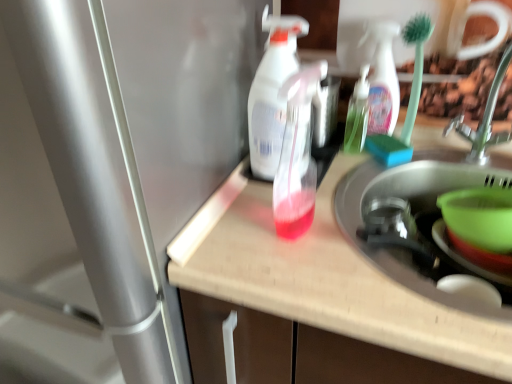
Question: From a real-world perspective, is metallic silver faucet at upper right below translucent plastic spray bottle at center, marked as the 1th bottle in a front-to-back arrangement?

Choices:
 (A) no
 (B) yes

Answer: (A)

Question: Is translucent plastic spray bottle at center, the 1th bottle in the left-to-right sequence, inside metallic silver faucet at upper right?

Choices:
 (A) yes
 (B) no

Answer: (B)

Question: Considering the relative sizes of metallic silver faucet at upper right and translucent plastic spray bottle at center, the second bottle in the back-to-front sequence, in the image provided, is metallic silver faucet at upper right taller than translucent plastic spray bottle at center, the second bottle in the back-to-front sequence,?

Choices:
 (A) yes
 (B) no

Answer: (A)

Question: Is metallic silver faucet at upper right turned away from translucent plastic spray bottle at center, which appears as the second bottle when viewed from the right?

Choices:
 (A) yes
 (B) no

Answer: (B)

Question: Considering the relative positions of metallic silver faucet at upper right and translucent plastic spray bottle at center, the second bottle in the back-to-front sequence, in the image provided, is metallic silver faucet at upper right to the right of translucent plastic spray bottle at center, the second bottle in the back-to-front sequence, from the viewer's perspective?

Choices:
 (A) no
 (B) yes

Answer: (B)

Question: Would you say translucent plastic spray bottle at center, marked as the 1th bottle in a front-to-back arrangement, is to the left or to the right of green plastic bowl at lower right in the picture?

Choices:
 (A) left
 (B) right

Answer: (A)

Question: Looking at their shapes, would you say translucent plastic spray bottle at center, the 1th bottle in the left-to-right sequence, is wider or thinner than green plastic bowl at lower right?

Choices:
 (A) wide
 (B) thin

Answer: (B)

Question: From the image's perspective, is translucent plastic spray bottle at center, which appears as the second bottle when viewed from the right, positioned above or below green plastic bowl at lower right?

Choices:
 (A) above
 (B) below

Answer: (A)

Question: From a real-world perspective, is translucent plastic spray bottle at center, the second bottle in the back-to-front sequence, above or below green plastic bowl at lower right?

Choices:
 (A) below
 (B) above

Answer: (B)

Question: Considering the positions of translucent plastic bottle at center and brushed metal water heater at left in the image, is translucent plastic bottle at center taller or shorter than brushed metal water heater at left?

Choices:
 (A) tall
 (B) short

Answer: (B)

Question: Based on their positions, is translucent plastic bottle at center located to the left or right of brushed metal water heater at left?

Choices:
 (A) left
 (B) right

Answer: (B)

Question: Relative to brushed metal water heater at left, is translucent plastic bottle at center in front or behind?

Choices:
 (A) behind
 (B) front

Answer: (A)

Question: Does point (329, 253) appear closer or farther from the camera than point (173, 193)?

Choices:
 (A) closer
 (B) farther

Answer: (B)

Question: Is green plastic bowl at sink right bigger or smaller than translucent plastic bottle at center, which is the 1th bottle from back to front?

Choices:
 (A) small
 (B) big

Answer: (B)

Question: Does point (483, 246) appear closer or farther from the camera than point (362, 145)?

Choices:
 (A) farther
 (B) closer

Answer: (B)